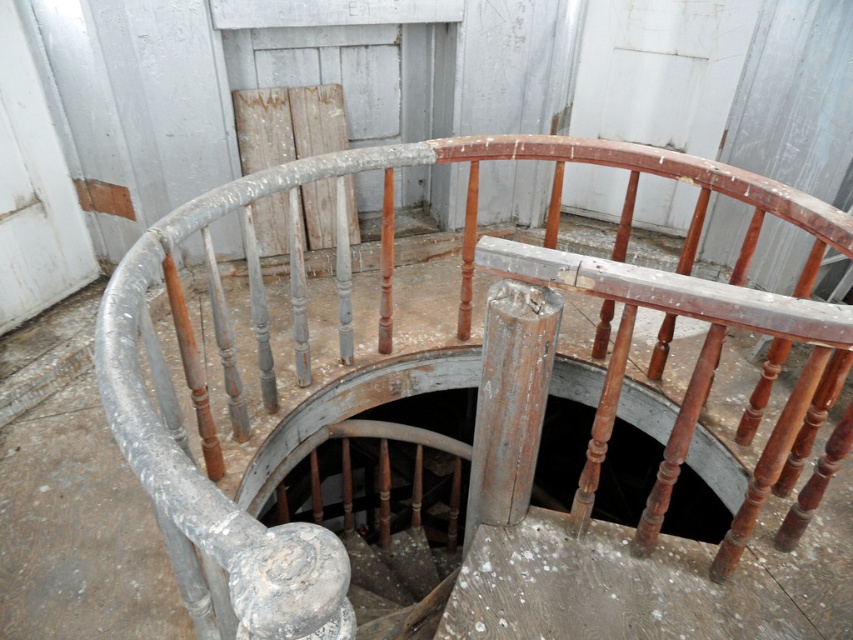
Is rusty wood railing at center thinner than dark wood hole at center?

No, rusty wood railing at center is not thinner than dark wood hole at center.

Which is more to the left, rusty wood railing at center or dark wood hole at center?

Positioned to the left is rusty wood railing at center.

Locate an element on the screen. rusty wood railing at center is located at coordinates (508, 426).